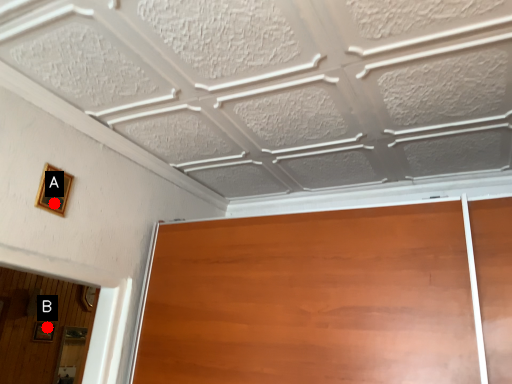
Question: Two points are circled on the image, labeled by A and B beside each circle. Which point appears farthest from the camera in this image?

Choices:
 (A) A is further
 (B) B is further

Answer: (B)